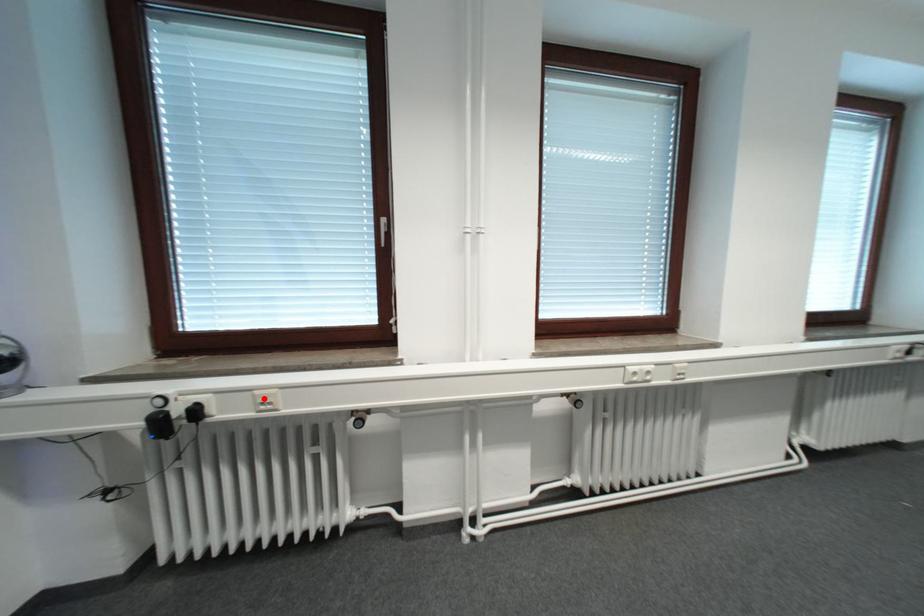
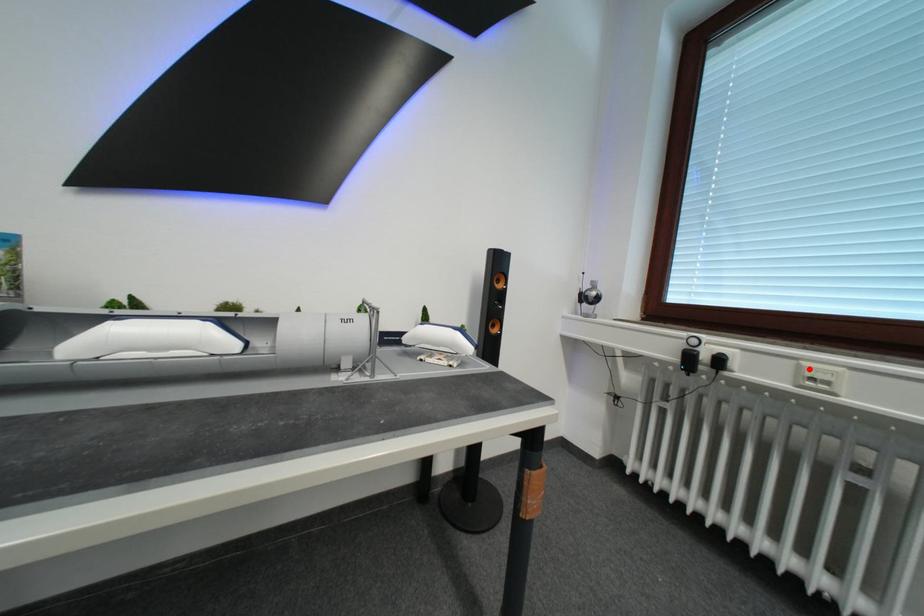
I am providing you with two images of the same scene from different viewpoints. A red point is marked on the first image and another point is marked on the second image. Do the highlighted points in image1 and image2 indicate the same real-world spot?

Yes